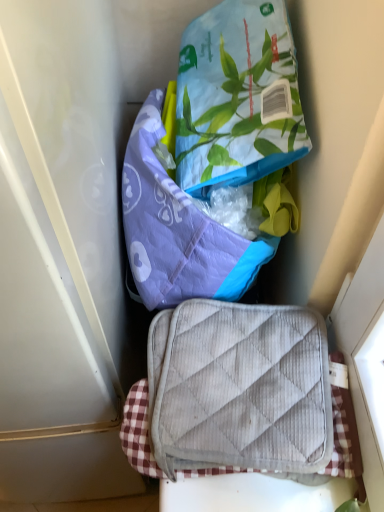
Question: Looking at their shapes, would you say purple quilted pouch at center, placed as the second pouch when sorted from top to bottom, is wider or thinner than printed fabric pouch at upper center, which appears as the second pouch when ordered from the bottom?

Choices:
 (A) wide
 (B) thin

Answer: (B)

Question: Visually, is purple quilted pouch at center, placed as the first pouch when sorted from bottom to top, positioned to the left or to the right of printed fabric pouch at upper center, the 1th pouch in the top-to-bottom sequence?

Choices:
 (A) right
 (B) left

Answer: (B)

Question: Based on their relative distances, which object is farther from the printed fabric pouch at upper center, which appears as the second pouch when ordered from the bottom?

Choices:
 (A) gray quilted suitcase at center
 (B) purple quilted pouch at center, placed as the second pouch when sorted from top to bottom

Answer: (A)

Question: Based on their relative distances, which object is nearer to the purple quilted pouch at center, placed as the second pouch when sorted from top to bottom?

Choices:
 (A) printed fabric pouch at upper center, the 1th pouch in the top-to-bottom sequence
 (B) gray quilted suitcase at center

Answer: (A)